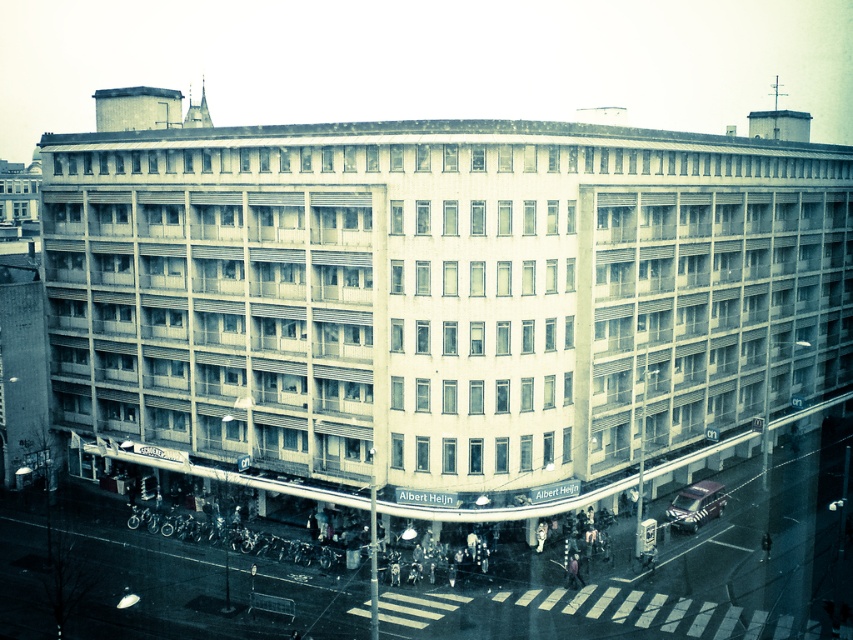
Does pink fabric person at lower center appear on the right side of dark fabric jacket at lower right?

In fact, pink fabric person at lower center is to the left of dark fabric jacket at lower right.

Who is shorter, pink fabric person at lower center or dark fabric jacket at lower right?

Standing shorter between the two is dark fabric jacket at lower right.

Based on the photo, who is more distant from viewer, (567, 582) or (761, 556)?

The point (761, 556) is behind.

Where is `pink fabric person at lower center`? Image resolution: width=853 pixels, height=640 pixels. pink fabric person at lower center is located at coordinates (573, 572).

Does metallic silver car at lower right lie in front of pink fabric person at lower center?

No, it is not.

Between point (699, 515) and point (573, 556), which one is positioned behind?

Positioned behind is point (699, 515).

Is point (718, 499) behind point (572, 568)?

Yes, point (718, 499) is behind point (572, 568).

The width and height of the screenshot is (853, 640). I want to click on metallic silver car at lower right, so click(695, 504).

Between metallic silver car at lower right and dark fabric jacket at lower right, which one is positioned higher?

metallic silver car at lower right

Locate an element on the screen. metallic silver car at lower right is located at coordinates (695, 504).

Identify the location of metallic silver car at lower right. (695, 504).